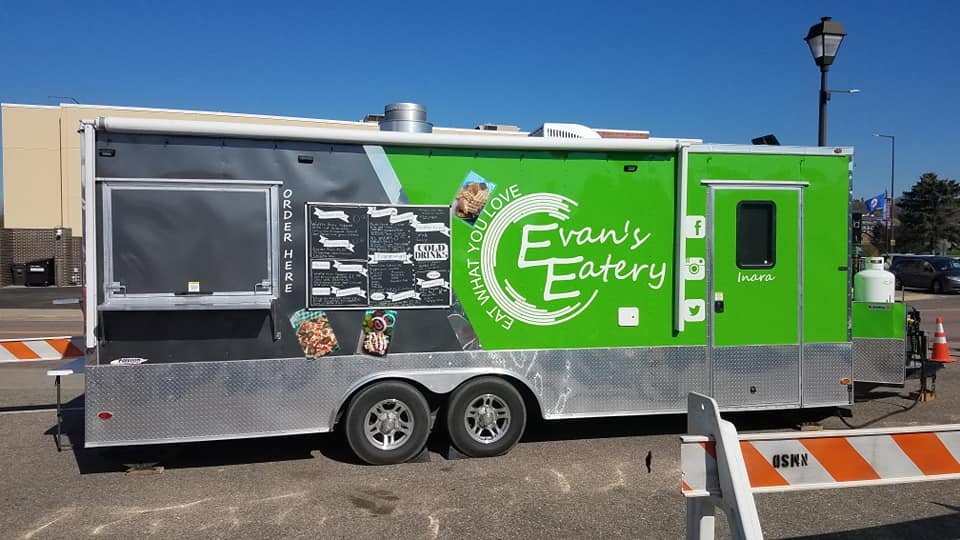
Identify the location of door. The image size is (960, 540). (735, 294).